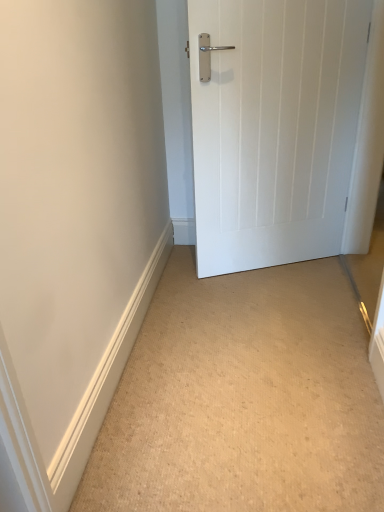
Question: Do you think beige carpet at lower center is within white wooden door at right, or outside of it?

Choices:
 (A) outside
 (B) inside

Answer: (A)

Question: In terms of size, does beige carpet at lower center appear bigger or smaller than white wooden door at right?

Choices:
 (A) big
 (B) small

Answer: (B)

Question: Based on their positions, is beige carpet at lower center located to the left or right of white wooden door at right?

Choices:
 (A) left
 (B) right

Answer: (A)

Question: Is white wooden door at right wider or thinner than beige carpet at lower center?

Choices:
 (A) thin
 (B) wide

Answer: (A)

Question: In terms of height, does white wooden door at right look taller or shorter compared to beige carpet at lower center?

Choices:
 (A) tall
 (B) short

Answer: (A)

Question: Does point (326, 80) appear closer or farther from the camera than point (192, 483)?

Choices:
 (A) farther
 (B) closer

Answer: (A)

Question: Would you say white wooden door at right is inside or outside beige carpet at lower center?

Choices:
 (A) outside
 (B) inside

Answer: (A)